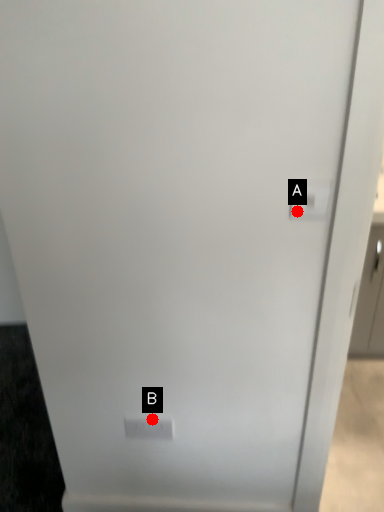
Question: Two points are circled on the image, labeled by A and B beside each circle. Which point appears farthest from the camera in this image?

Choices:
 (A) A is further
 (B) B is further

Answer: (B)